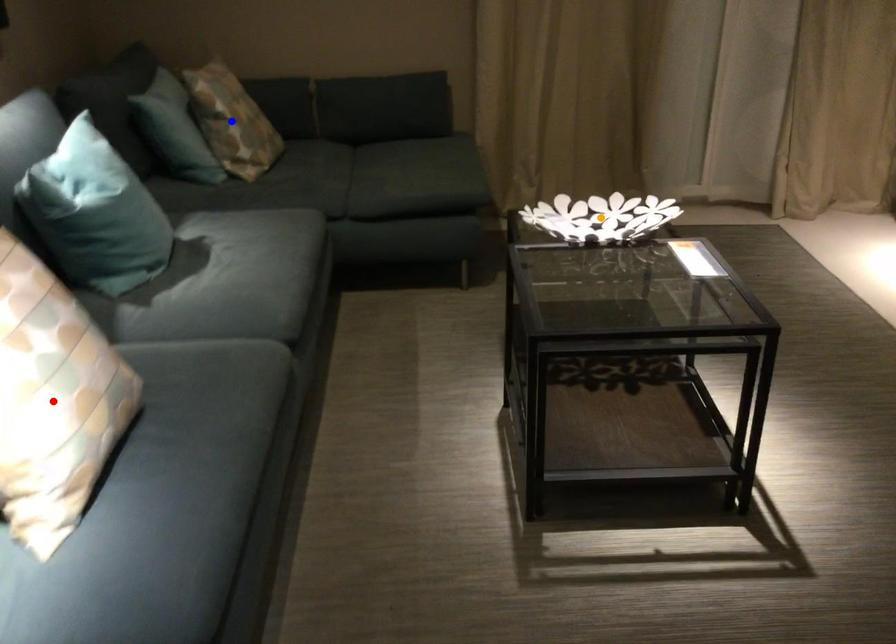
Order these from nearest to farthest:
red point
orange point
blue point

red point
orange point
blue point